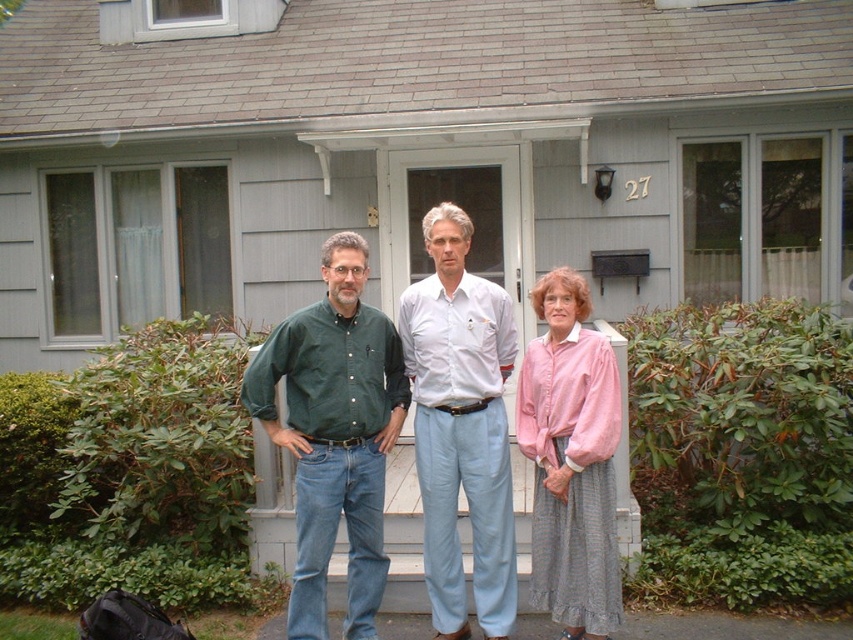
You are a photographer setting up a camera on the porch. You need to ensure that both the green cotton shirt at center and the pink linen blouse at center are fully visible in the frame. Which person should you position closer to the camera to avoid cropping either of them?

The green cotton shirt at center might be wider than the pink linen blouse at center, so positioning the person in the green cotton shirt at center closer to the camera would help ensure both are fully visible without cropping.

You are a fashion designer observing the person at the center of the porch. You need to determine if their clothing items are arranged properly. According to the image, is the green cotton shirt at center positioned correctly over the light blue cotton pants at center?

Yes, the green cotton shirt at center is positioned correctly above the light blue cotton pants at center as described in the scene.